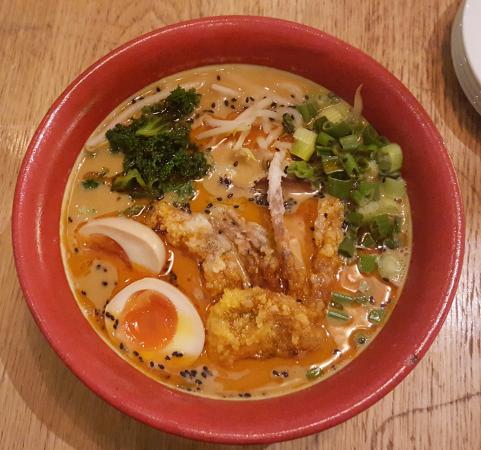
I want to click on wood table, so click(37, 396), click(55, 51), click(411, 36), click(453, 383).